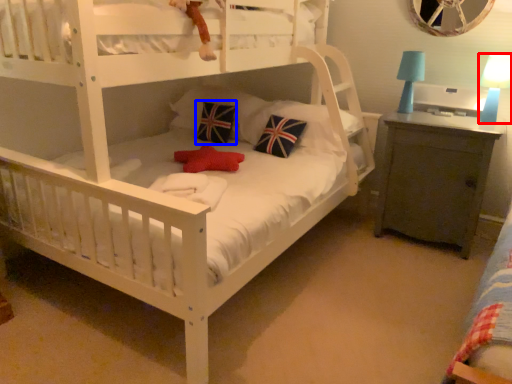
Question: Which object appears closest to the camera in this image, table lamp (highlighted by a red box) or pillow (highlighted by a blue box)?

Choices:
 (A) table lamp
 (B) pillow

Answer: (A)